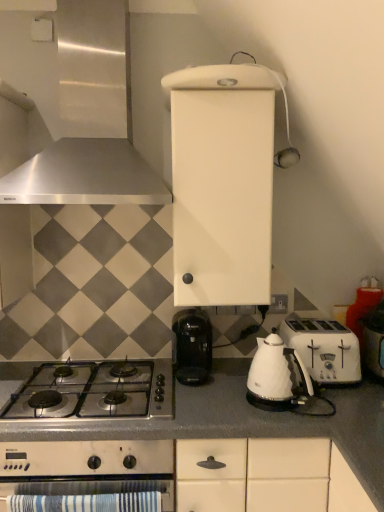
You are a GUI agent. You are given a task and a screenshot of the screen. Output one action in this format:
    pyautogui.click(x=<x>, y=<y>)
    Task: Click on the vacant space situated on the left part of white glossy kettle at lower center
    
    Given the screenshot: What is the action you would take?
    pyautogui.click(x=219, y=401)